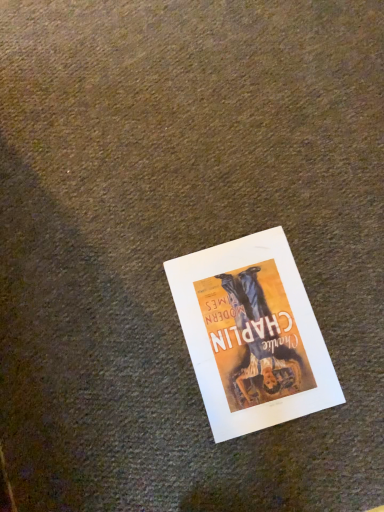
Identify the location of vacant area on the back side of white paper poster at center. The height and width of the screenshot is (512, 384). (209, 196).